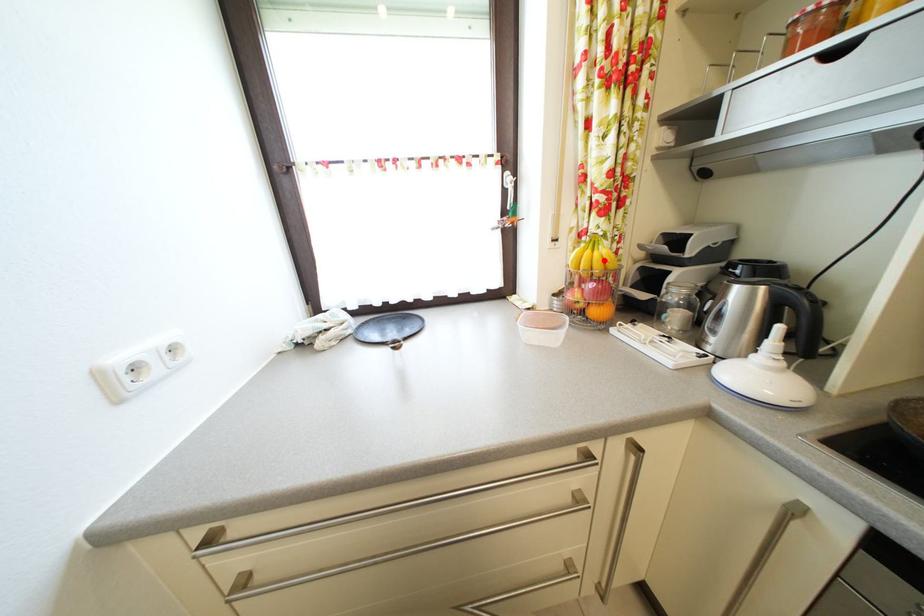
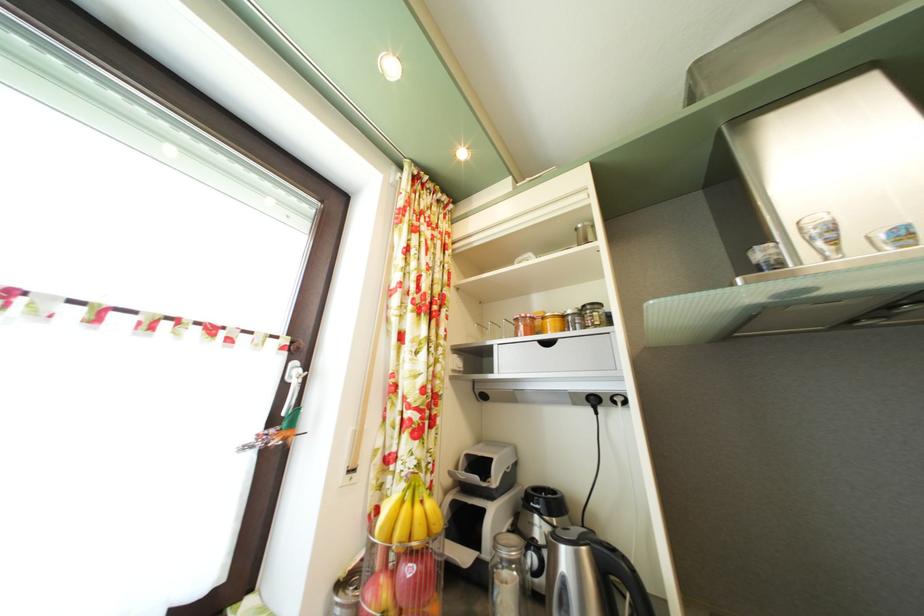
Where in the second image is the point corresponding to the highlighted location from the first image?

(426, 516)